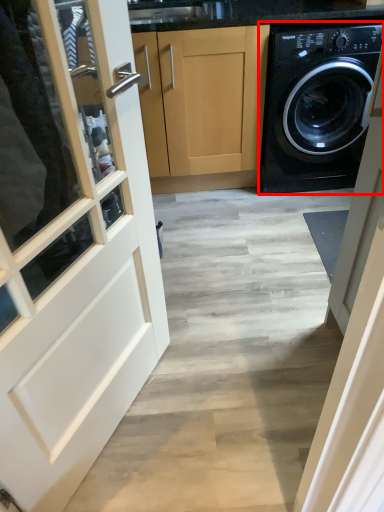
Question: From the image, what is the correct spatial relationship of washing machine (annotated by the red box) in relation to cabinetry?

Choices:
 (A) left
 (B) right

Answer: (B)